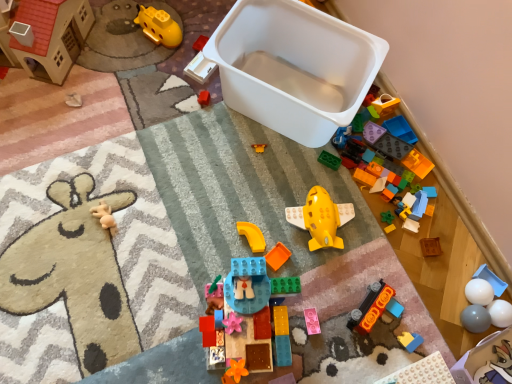
Question: In terms of width, does orange matte car at lower right, the 8th toy in the right-to-left sequence, look wider or thinner when compared to white plastic storage box at lower right, the 2th storage box from the top?

Choices:
 (A) thin
 (B) wide

Answer: (A)

Question: Is orange matte car at lower right, the 8th toy in the right-to-left sequence, to the left or to the right of white plastic storage box at lower right, placed as the 1th storage box when sorted from right to left, in the image?

Choices:
 (A) right
 (B) left

Answer: (B)

Question: Based on their relative distances, which object is farther from the wooden block at center, which is the third toy from right to left?

Choices:
 (A) orange matte block at center, the 11th toy from the right
 (B) translucent blue plastic building block at center, the fifth toy viewed from the left
 (C) matte green block at center, the 6th toy in the right-to-left sequence
 (D) white plastic storage box at lower right, placed as the 1th storage box when sorted from right to left
 (E) pearl white plastic plate at lower right, arranged as the fourth toy when viewed from the right

Answer: (B)

Question: Which object is the farthest from the white plastic tray at upper center, placed as the 13th toy when sorted from right to left?

Choices:
 (A) green matte block at center, the seventh toy when ordered from right to left
 (B) yellow matte airplane at center, the ninth toy from the right
 (C) yellow plastic submarine at upper left, which ranks as the fourteenth toy in right-to-left order
 (D) matte plastic toy at lower right, which is counted as the 12th toy, starting from the left
 (E) orange matte car at lower right, the 8th toy in the right-to-left sequence

Answer: (D)